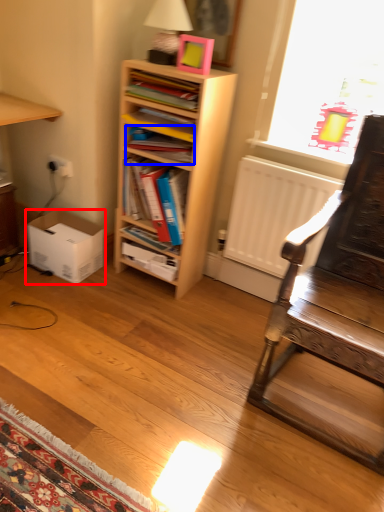
Question: Which object is closer to the camera taking this photo, box (highlighted by a red box) or book (highlighted by a blue box)?

Choices:
 (A) box
 (B) book

Answer: (B)